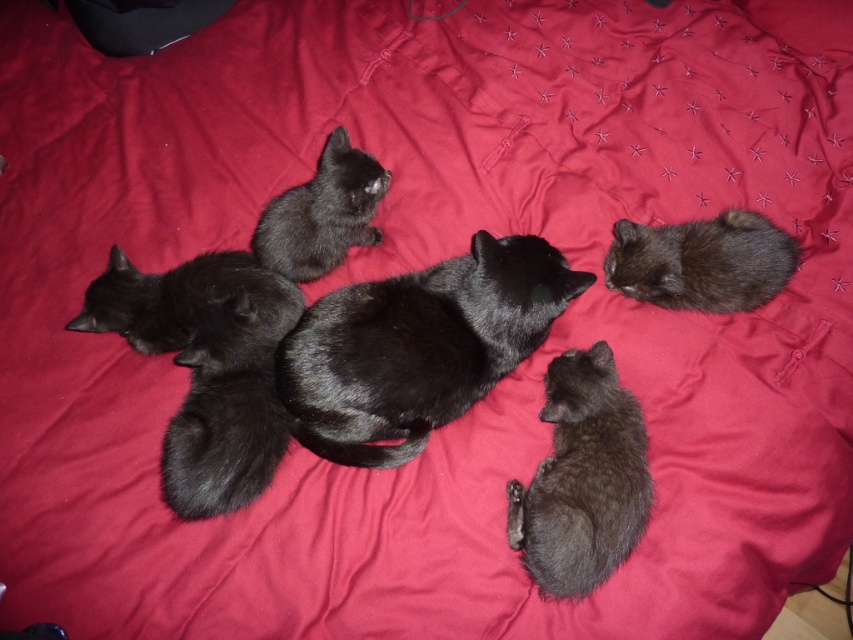
Question: Among these objects, which one is nearest to the camera?

Choices:
 (A) black matte cat at left
 (B) matte black cat at center
 (C) shiny black cat at upper right

Answer: (B)

Question: Is shiny black cat at center closer to the viewer compared to black matte cat at left?

Choices:
 (A) no
 (B) yes

Answer: (B)

Question: Does soft fur kitten at center appear on the left side of matte black cat at center?

Choices:
 (A) yes
 (B) no

Answer: (B)

Question: Which object is the farthest from the matte black cat at center?

Choices:
 (A) black matte cat at left
 (B) shiny black cat at upper right
 (C) matte black kitten at upper center
 (D) soft fur kitten at center

Answer: (B)

Question: Estimate the real-world distances between objects in this image. Which object is farther from the shiny black cat at center?

Choices:
 (A) black matte cat at left
 (B) shiny black cat at upper right

Answer: (B)

Question: Is matte black cat at center further to camera compared to shiny black cat at upper right?

Choices:
 (A) yes
 (B) no

Answer: (B)